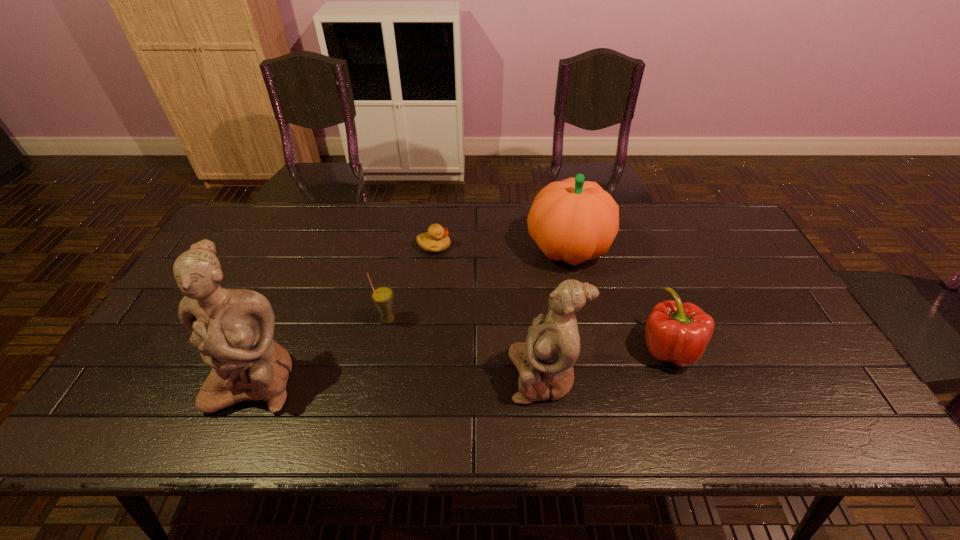
Locate an element on the screen. free spot between the third object from left to right and the pumpkin is located at coordinates (501, 247).

This screenshot has height=540, width=960. In order to click on free space between the pumpkin and the fifth object from right to left in this screenshot , I will do `click(478, 284)`.

Locate an element on the screen. The width and height of the screenshot is (960, 540). object that is the fifth closest one to the second object from left to right is located at coordinates (676, 332).

Find the location of a particular element. This screenshot has height=540, width=960. object that can be found as the closest to the duckling is located at coordinates (382, 296).

This screenshot has height=540, width=960. I want to click on vacant space that satisfies the following two spatial constraints: 1. at the beak of the duckling; 2. on the left side of the pepper, so click(x=422, y=348).

Locate an element on the screen. free space that satisfies the following two spatial constraints: 1. at the beak of the fourth object from right to left; 2. on the back side of the pepper is located at coordinates (422, 348).

Locate an element on the screen. vacant area in the image that satisfies the following two spatial constraints: 1. at the beak of the duckling; 2. on the front-facing side of the left figurine is located at coordinates (420, 379).

Locate an element on the screen. vacant area in the image that satisfies the following two spatial constraints: 1. on the front-facing side of the shorter figurine; 2. on the front-facing side of the tallest object is located at coordinates (543, 379).

I want to click on blank area in the image that satisfies the following two spatial constraints: 1. at the beak of the shortest object; 2. on the front-facing side of the tallest object, so click(420, 379).